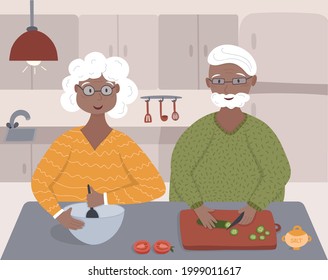
Image resolution: width=328 pixels, height=280 pixels. I want to click on red cutting board, so click(x=212, y=238).